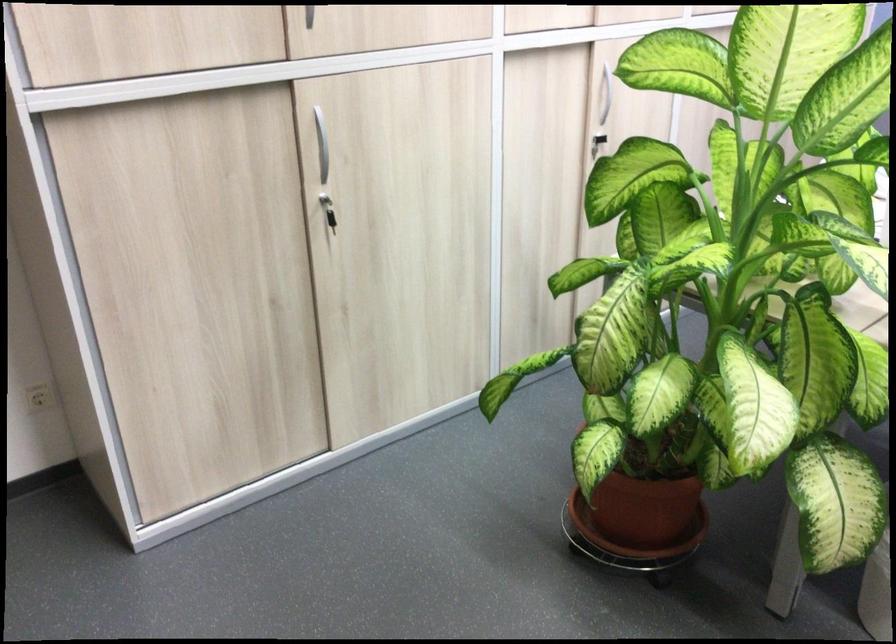
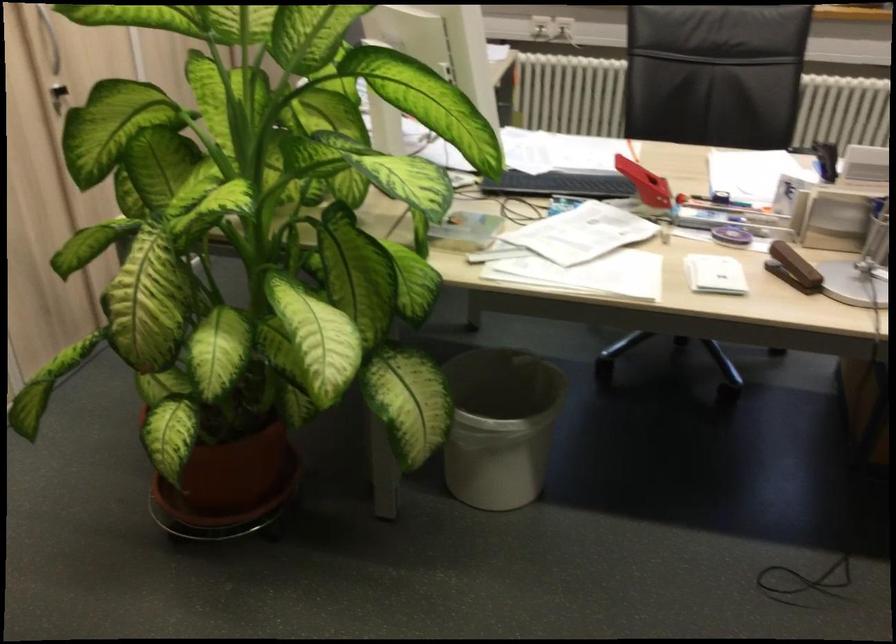
Find the pixel in the second image that matches point (625, 514) in the first image.

(228, 487)